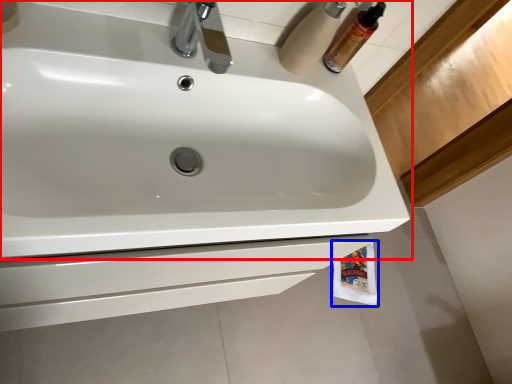
Question: Which object is further to the camera taking this photo, sink (highlighted by a red box) or toilet paper (highlighted by a blue box)?

Choices:
 (A) sink
 (B) toilet paper

Answer: (B)